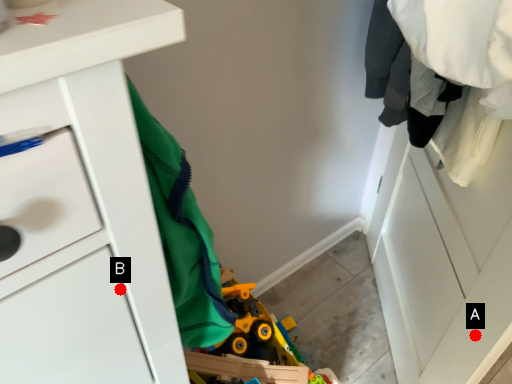
Question: Two points are circled on the image, labeled by A and B beside each circle. Which point is closer to the camera?

Choices:
 (A) A is closer
 (B) B is closer

Answer: (B)